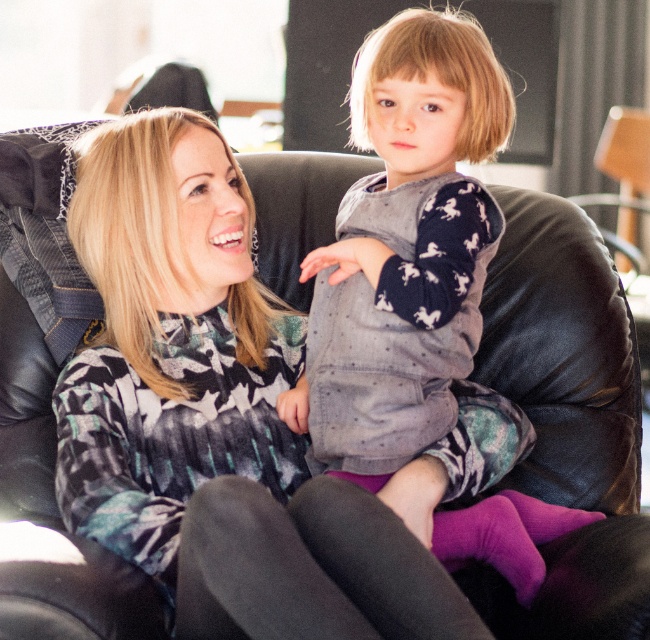
Question: Can you confirm if knit sweater at center is positioned below purple matte leggings at center?

Choices:
 (A) no
 (B) yes

Answer: (A)

Question: Which object appears farthest from the camera in this image?

Choices:
 (A) knit sweater at center
 (B) purple matte leggings at center

Answer: (A)

Question: Does knit sweater at center have a smaller size compared to purple matte leggings at center?

Choices:
 (A) yes
 (B) no

Answer: (B)

Question: Which point appears closest to the camera in this image?

Choices:
 (A) (410, 54)
 (B) (203, 497)

Answer: (B)

Question: Can you confirm if knit sweater at center is positioned to the left of purple matte leggings at center?

Choices:
 (A) no
 (B) yes

Answer: (A)